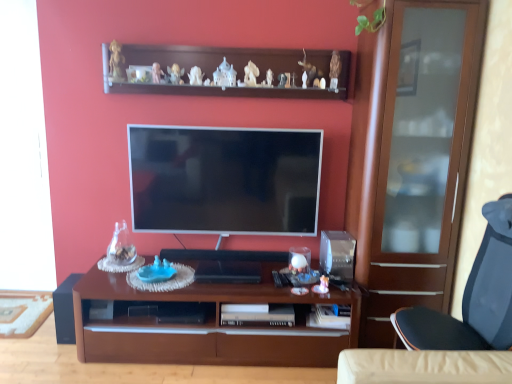
Question: Is white glossy television at center taller than wooden shelf at upper center?

Choices:
 (A) no
 (B) yes

Answer: (B)

Question: From a real-world perspective, is white glossy television at center beneath wooden shelf at upper center?

Choices:
 (A) no
 (B) yes

Answer: (B)

Question: Does white glossy television at center have a lesser height compared to wooden shelf at upper center?

Choices:
 (A) no
 (B) yes

Answer: (A)

Question: Does white glossy television at center lie behind wooden shelf at upper center?

Choices:
 (A) yes
 (B) no

Answer: (A)

Question: Considering the relative sizes of white glossy television at center and wooden shelf at upper center in the image provided, is white glossy television at center wider than wooden shelf at upper center?

Choices:
 (A) no
 (B) yes

Answer: (A)

Question: From the image's perspective, does white glossy television at center appear higher than wooden shelf at upper center?

Choices:
 (A) yes
 (B) no

Answer: (B)

Question: Is the depth of black matte speaker at lower left less than that of blue plastic toy at center?

Choices:
 (A) yes
 (B) no

Answer: (B)

Question: Is black matte speaker at lower left positioned with its back to blue plastic toy at center?

Choices:
 (A) yes
 (B) no

Answer: (B)

Question: Can you confirm if black matte speaker at lower left is bigger than blue plastic toy at center?

Choices:
 (A) no
 (B) yes

Answer: (B)

Question: Could you tell me if black matte speaker at lower left is turned towards blue plastic toy at center?

Choices:
 (A) no
 (B) yes

Answer: (A)

Question: Is black matte speaker at lower left outside blue plastic toy at center?

Choices:
 (A) no
 (B) yes

Answer: (B)

Question: Considering the relative sizes of black matte speaker at lower left and blue plastic toy at center in the image provided, is black matte speaker at lower left shorter than blue plastic toy at center?

Choices:
 (A) yes
 (B) no

Answer: (B)

Question: Is white glossy television at center next to black matte speaker at lower left and touching it?

Choices:
 (A) yes
 (B) no

Answer: (B)